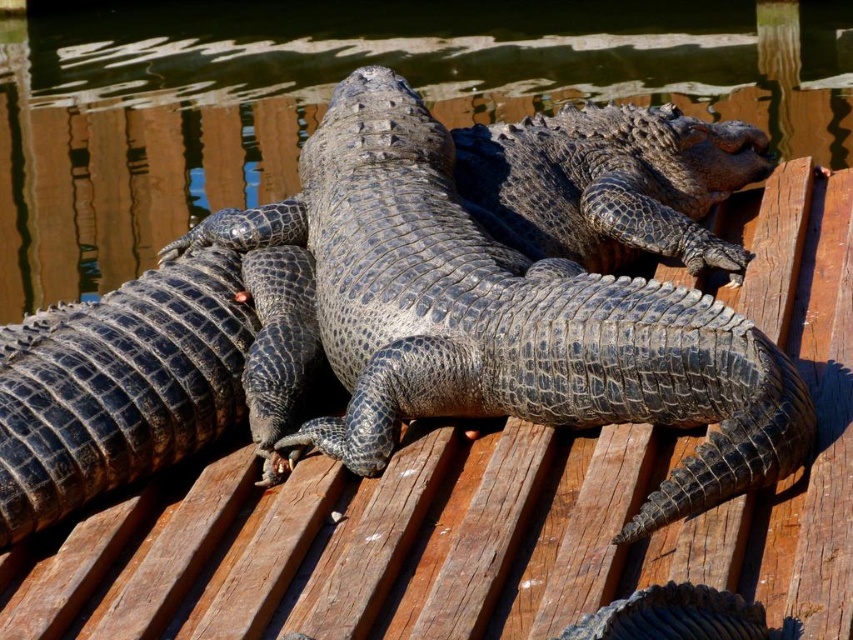
Question: In this image, where is glossy black crocodile at center located relative to leathery dark gray crocodile at center?

Choices:
 (A) right
 (B) left

Answer: (B)

Question: Among these points, which one is nearest to the camera?

Choices:
 (A) (639, 342)
 (B) (579, 36)

Answer: (A)

Question: Is glossy black crocodile at center smaller than leathery dark gray crocodile at center?

Choices:
 (A) yes
 (B) no

Answer: (B)

Question: Can you confirm if glossy black crocodile at center is positioned below leathery dark gray crocodile at center?

Choices:
 (A) no
 (B) yes

Answer: (A)

Question: Which object is closer to the camera taking this photo?

Choices:
 (A) leathery dark gray crocodile at center
 (B) glossy black crocodile at center

Answer: (A)

Question: Which object appears closest to the camera in this image?

Choices:
 (A) glossy black crocodile at center
 (B) leathery dark gray crocodile at center

Answer: (B)